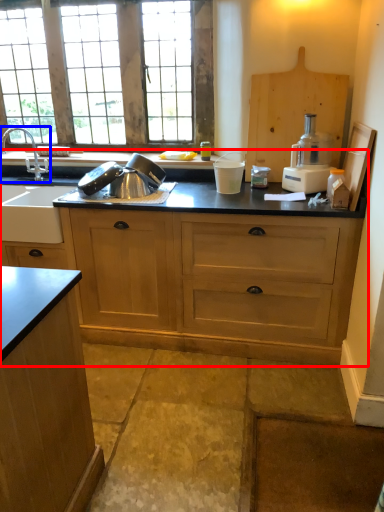
Question: Among these objects, which one is nearest to the camera, countertop (highlighted by a red box) or tap (highlighted by a blue box)?

Choices:
 (A) countertop
 (B) tap

Answer: (A)